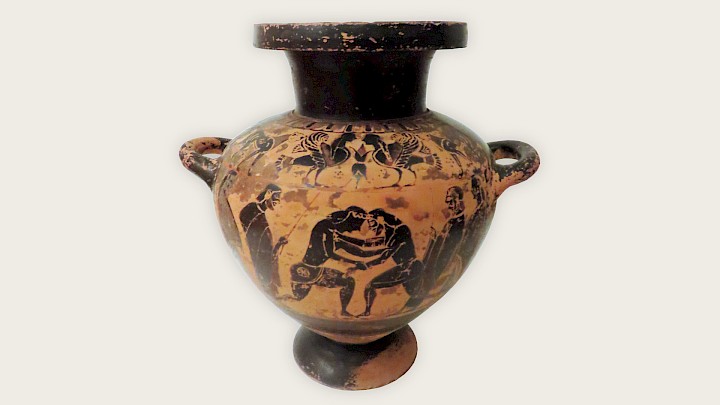
Locate an element on the screen. This screenshot has width=720, height=405. brown space of vase is located at coordinates (392, 376), (360, 331), (294, 224), (422, 206), (353, 175), (266, 176), (433, 156).